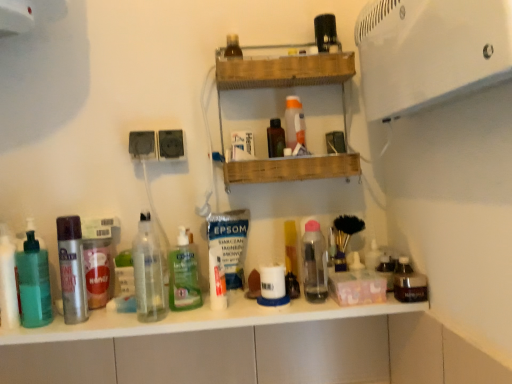
Question: Is white glossy counter top at center further to the viewer compared to clear glass bottle at center, the 3th bottle from the left?

Choices:
 (A) no
 (B) yes

Answer: (A)

Question: From a real-world perspective, is white glossy counter top at center positioned over clear glass bottle at center, the 3th bottle from the left, based on gravity?

Choices:
 (A) yes
 (B) no

Answer: (B)

Question: Is white glossy counter top at center positioned before clear glass bottle at center, the third bottle viewed from the right?

Choices:
 (A) yes
 (B) no

Answer: (A)

Question: Is white glossy counter top at center at the left side of clear glass bottle at center, the 3th bottle from the left?

Choices:
 (A) yes
 (B) no

Answer: (B)

Question: Is white glossy counter top at center not near clear glass bottle at center, the 3th bottle from the left?

Choices:
 (A) yes
 (B) no

Answer: (B)

Question: From the image's perspective, is white glossy counter top at center above clear glass bottle at center, the third bottle viewed from the right?

Choices:
 (A) yes
 (B) no

Answer: (B)

Question: Is the position of green translucent bottle at center, which is counted as the second bottle, starting from the right, more distant than that of white matte tube at center, the second toiletry ordered from the bottom?

Choices:
 (A) no
 (B) yes

Answer: (B)

Question: Does green translucent bottle at center, the fourth bottle when ordered from left to right, have a lesser height compared to white matte tube at center, the second toiletry ordered from the bottom?

Choices:
 (A) yes
 (B) no

Answer: (B)

Question: Can you confirm if green translucent bottle at center, which is counted as the second bottle, starting from the right, is bigger than white matte tube at center, the second toiletry ordered from the bottom?

Choices:
 (A) yes
 (B) no

Answer: (A)

Question: From a real-world perspective, is green translucent bottle at center, the fourth bottle when ordered from left to right, on top of white matte tube at center, which is counted as the 3th toiletry, starting from the top?

Choices:
 (A) no
 (B) yes

Answer: (B)

Question: Considering the relative sizes of green translucent bottle at center, the fourth bottle when ordered from left to right, and white matte tube at center, the third toiletry viewed from the right, in the image provided, is green translucent bottle at center, the fourth bottle when ordered from left to right, wider than white matte tube at center, the third toiletry viewed from the right,?

Choices:
 (A) no
 (B) yes

Answer: (B)

Question: Is green translucent bottle at center, the fourth bottle when ordered from left to right, to the right of white matte tube at center, the third toiletry viewed from the right, from the viewer's perspective?

Choices:
 (A) yes
 (B) no

Answer: (B)

Question: From the image's perspective, is clear glass bottle at center, the 3th bottle from the left, located beneath silver metallic spray can at left, placed as the second bottle when sorted from left to right?

Choices:
 (A) no
 (B) yes

Answer: (A)